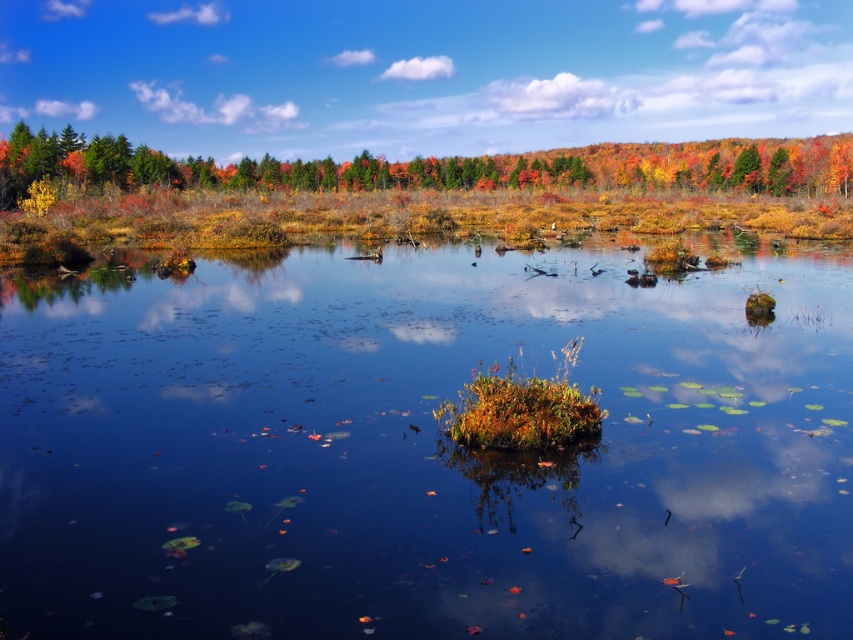
You are an artist planning to paint the autumn scene. You notice the autumn foliage at upper center and orange autumn leaves at upper right. Which of these two elements is positioned lower in the image?

The autumn foliage at upper center is located below orange autumn leaves at upper right, so it is positioned lower in the image.

You are standing at the edge of the water and want to pick up the orange autumn leaves at upper right. Which direction should you move relative to the autumn foliage at upper center?

You should move to the right of the autumn foliage at upper center to reach the orange autumn leaves at upper right since the autumn foliage at upper center is to the left of orange autumn leaves at upper right.